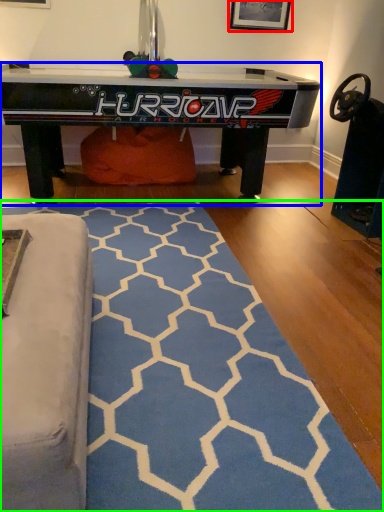
Question: Which object is positioned farthest from picture frame (highlighted by a red box)? Select from table (highlighted by a blue box) and mat (highlighted by a green box).

Choices:
 (A) table
 (B) mat

Answer: (B)